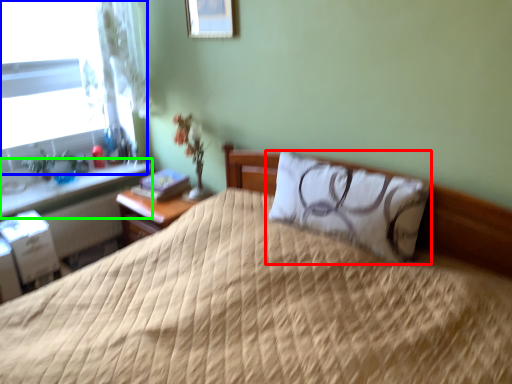
Question: Which object is the closest to the pillow (highlighted by a red box)? Choose among these: window (highlighted by a blue box) or window sill (highlighted by a green box).

Choices:
 (A) window
 (B) window sill

Answer: (B)